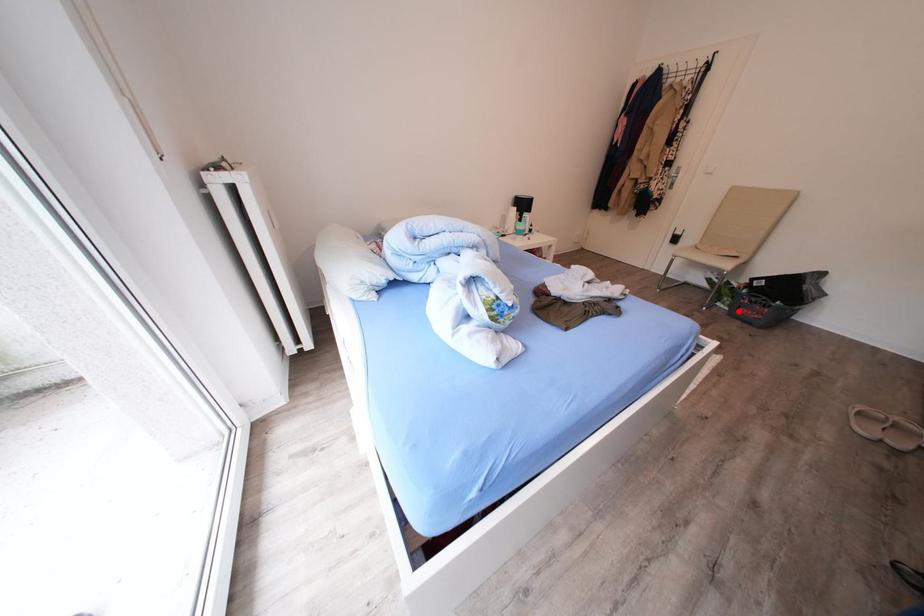
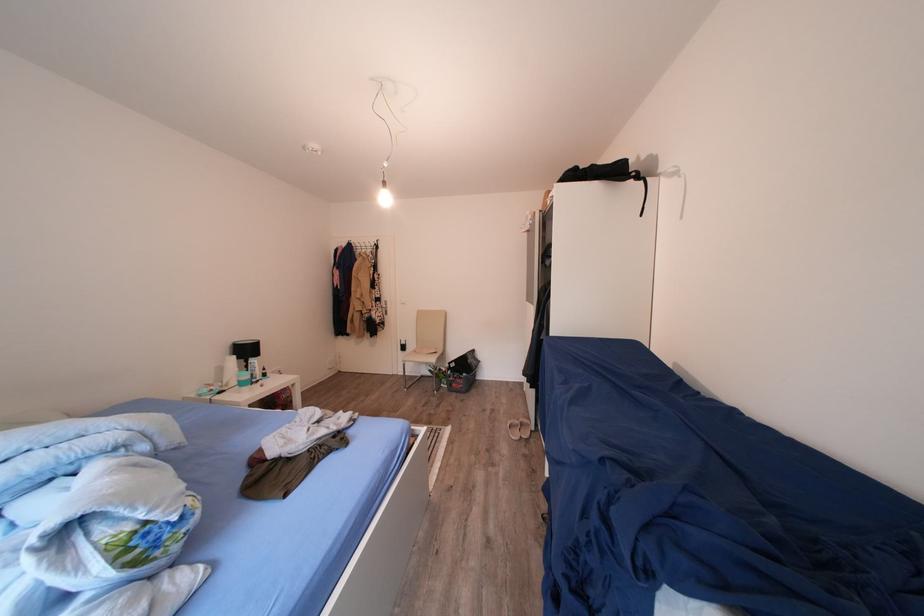
Question: I am providing you with two images of the same scene from different viewpoints. In image1, a red point is highlighted. Considering the same 3D point in image2, which of the following is correct?

Choices:
 (A) It is closer
 (B) It is farther

Answer: (B)